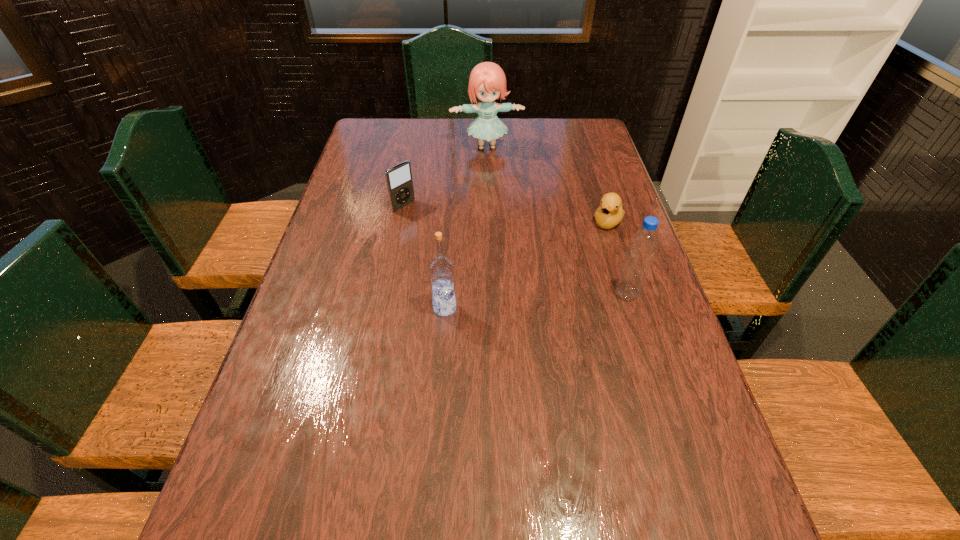
In order to click on duckling located in the right edge section of the desktop in this screenshot , I will do `click(610, 212)`.

Find the location of a particular element. This screenshot has width=960, height=540. free spot at the far edge of the desktop is located at coordinates (430, 134).

Identify the location of vacant region at the near edge of the desktop. [x=460, y=458].

Find the location of `free space at the left edge of the desktop`. free space at the left edge of the desktop is located at coordinates (376, 222).

Locate an element on the screen. vacant space at the right edge of the desktop is located at coordinates (636, 306).

Identify the location of vacant space at the far left corner. The image size is (960, 540). pos(381,139).

At what (x,y) coordinates should I click in order to perform the action: click on vacant region between the water bottle and the leftmost object. Please return your answer as a coordinate pair (x, y). Looking at the image, I should click on (515, 250).

Locate an element on the screen. free area in between the vodka and the farthest object is located at coordinates (466, 227).

This screenshot has width=960, height=540. I want to click on empty space between the vodka and the duckling, so click(x=526, y=265).

You are a GUI agent. You are given a task and a screenshot of the screen. Output one action in this format:
    pyautogui.click(x=<x>, y=<y>)
    Task: Click on the vacant area that lies between the shortest object and the farthest object
    This screenshot has width=960, height=540.
    Given the screenshot: What is the action you would take?
    pyautogui.click(x=547, y=184)